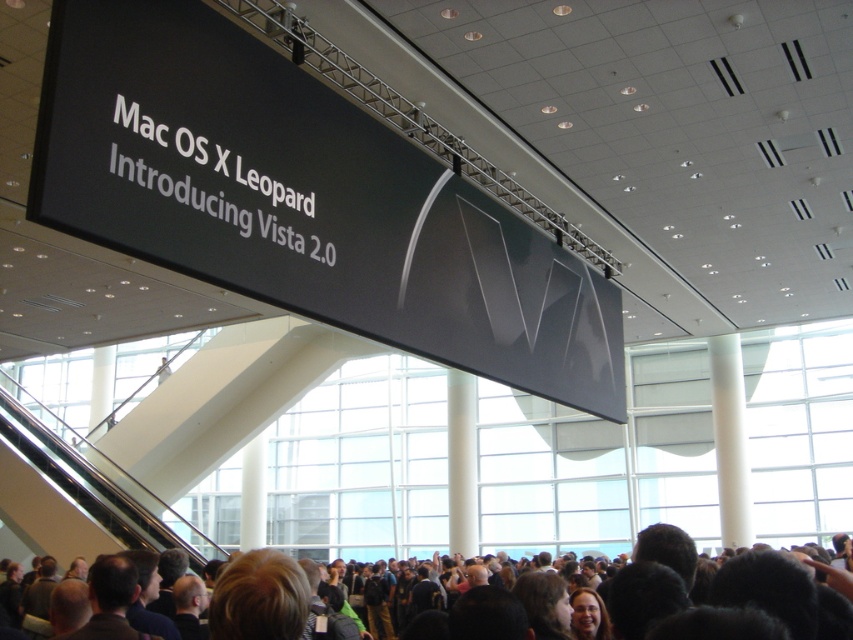
You are standing in the conference hall and see the dark brown hair at lower center and the black plastic escalator at lower left. Which object is closer to the ceiling?

The dark brown hair at lower center is located above the black plastic escalator at lower left, so it is closer to the ceiling.

You are standing in the conference hall and see the point at coordinates (724, 586). According to the image, what object or feature is located at that point?

The point at coordinates (724, 586) is located on dark brown hair at lower center.